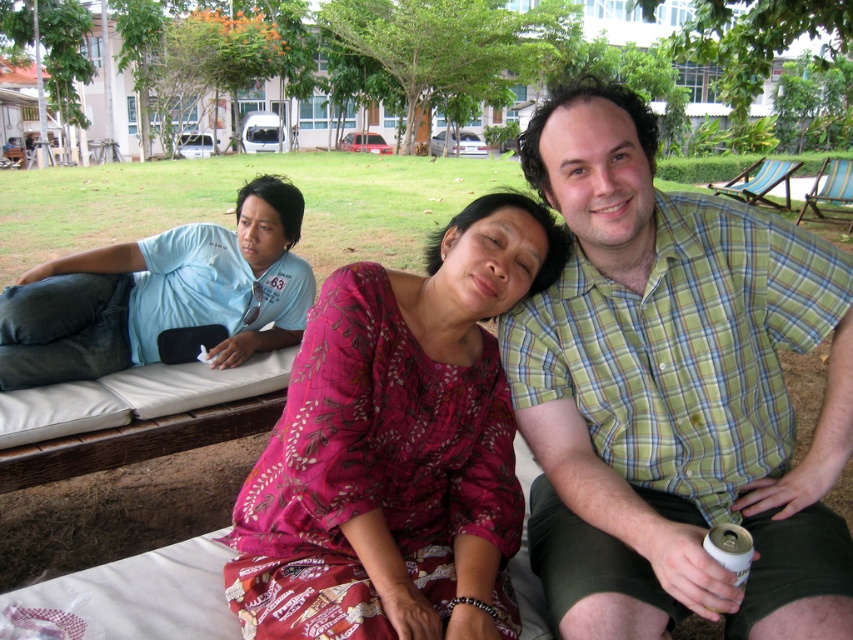
Question: Considering the relative positions of green plaid shirt at center and pink printed dress at center in the image provided, where is green plaid shirt at center located with respect to pink printed dress at center?

Choices:
 (A) above
 (B) below

Answer: (A)

Question: Among these points, which one is farthest from the camera?

Choices:
 (A) (833, 360)
 (B) (259, 237)
 (C) (457, 227)

Answer: (B)

Question: Can you confirm if green plaid shirt at center is bigger than blue t-shirt at left?

Choices:
 (A) no
 (B) yes

Answer: (A)

Question: Among these objects, which one is farthest from the camera?

Choices:
 (A) green plaid shirt at center
 (B) blue t-shirt at left

Answer: (B)

Question: Is green plaid shirt at center positioned behind pink printed dress at center?

Choices:
 (A) no
 (B) yes

Answer: (A)

Question: Which of the following is the farthest from the observer?

Choices:
 (A) green plaid shirt at center
 (B) blue t-shirt at left

Answer: (B)